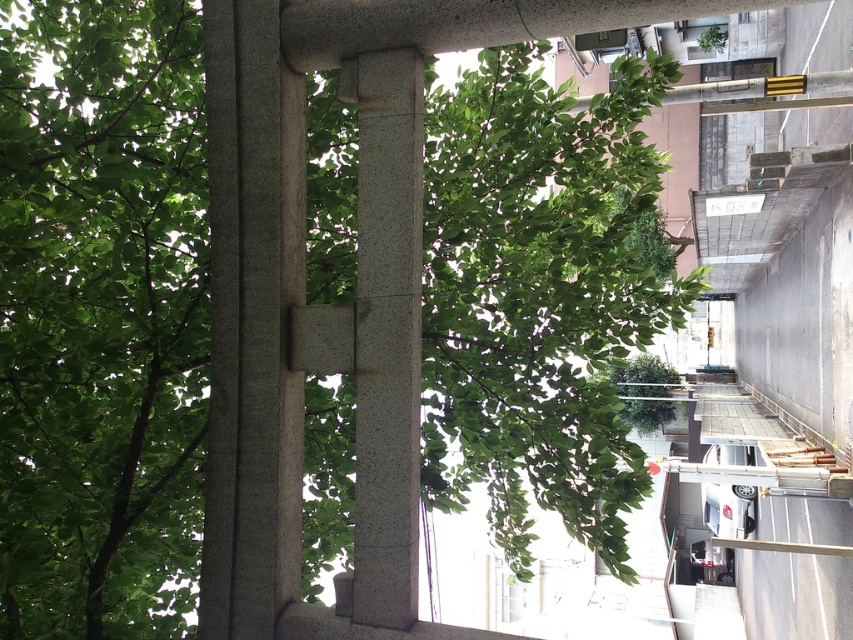
Question: Can you confirm if slate gray stone pillar at center is wider than smooth gray stone pillar at center?

Choices:
 (A) no
 (B) yes

Answer: (B)

Question: Is slate gray stone pillar at center smaller than smooth gray stone pillar at center?

Choices:
 (A) yes
 (B) no

Answer: (B)

Question: Where is slate gray stone pillar at center located in relation to smooth gray stone pillar at center in the image?

Choices:
 (A) below
 (B) above

Answer: (B)